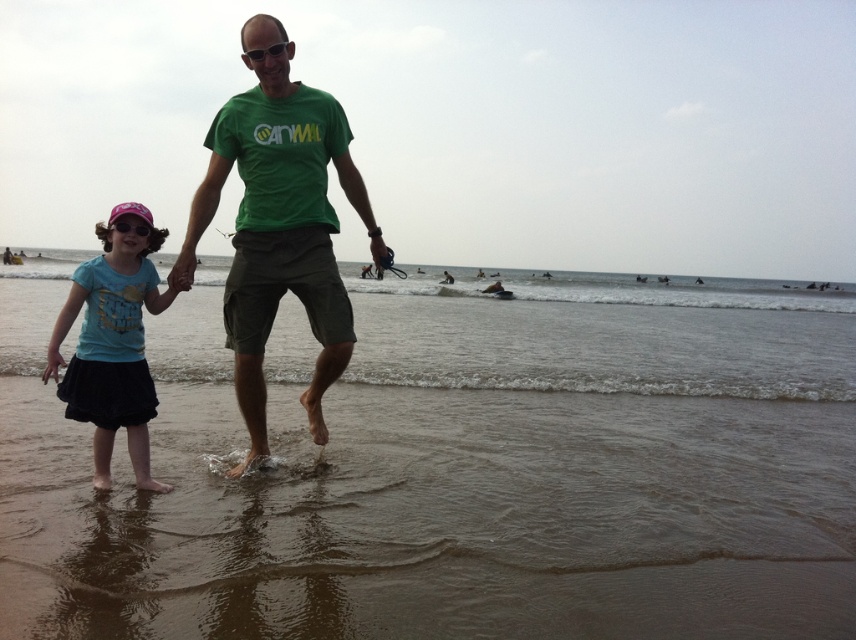
You are a photographer standing on the beach and want to take a photo of the blue cotton shirt at lower left and the pink plastic goggles at left. Which object should you focus on first if you want to capture both in the same frame without moving the camera?

The blue cotton shirt at lower left is positioned under the pink plastic goggles at left, so you should focus on the pink plastic goggles at left first to ensure both are in the frame.

You are a photographer trying to capture the scene from the camera position. The blue cotton shirt at lower left and the pink plastic goggles at left are both in the frame. Which object is wider in the photo?

The blue cotton shirt at lower left might be wider than pink plastic goggles at left according to the description.